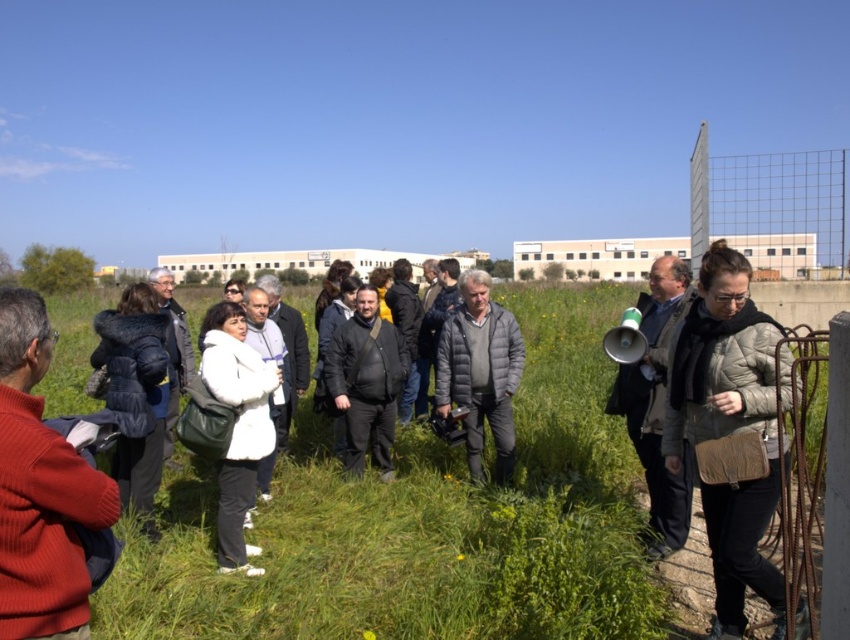
Question: Which is farther from the matte beige jacket at lower right?

Choices:
 (A) green grass at center
 (B) dark blue fur coat at center-left
 (C) white fur coat at center
 (D) green plastic megaphone at center-right

Answer: (B)

Question: Does gray down jacket at center appear under dark gray jacket at center?

Choices:
 (A) no
 (B) yes

Answer: (A)

Question: Is the position of green grass at center less distant than that of gray down jacket at center?

Choices:
 (A) no
 (B) yes

Answer: (B)

Question: Which of the following is the farthest from the observer?

Choices:
 (A) dark blue fur coat at center-left
 (B) dark gray jacket at center

Answer: (B)

Question: Is the position of green grass at center more distant than that of knitted red sweater at lower left?

Choices:
 (A) yes
 (B) no

Answer: (A)

Question: Which point appears closest to the camera in this image?

Choices:
 (A) (777, 230)
 (B) (405, 364)
 (C) (499, 476)
 (D) (60, 618)

Answer: (D)